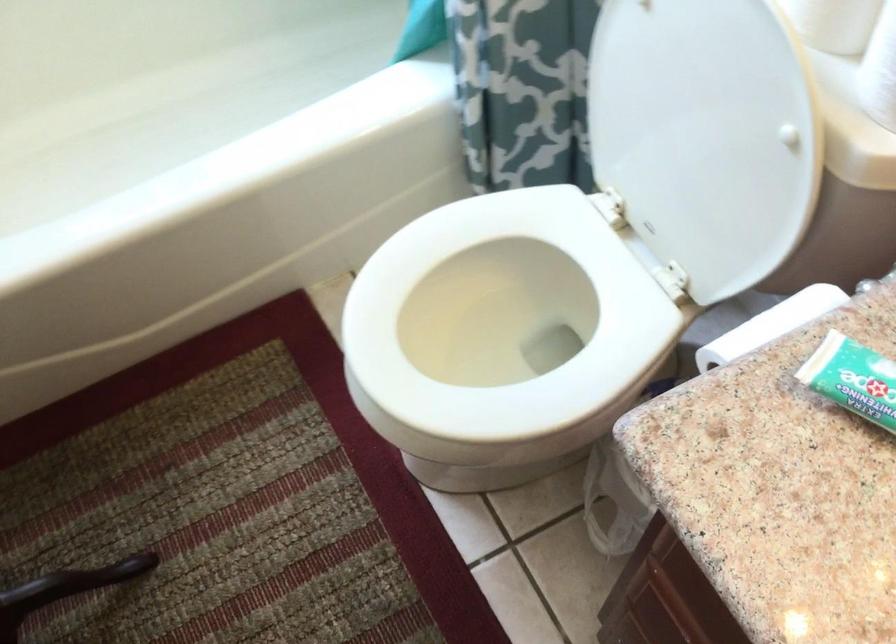
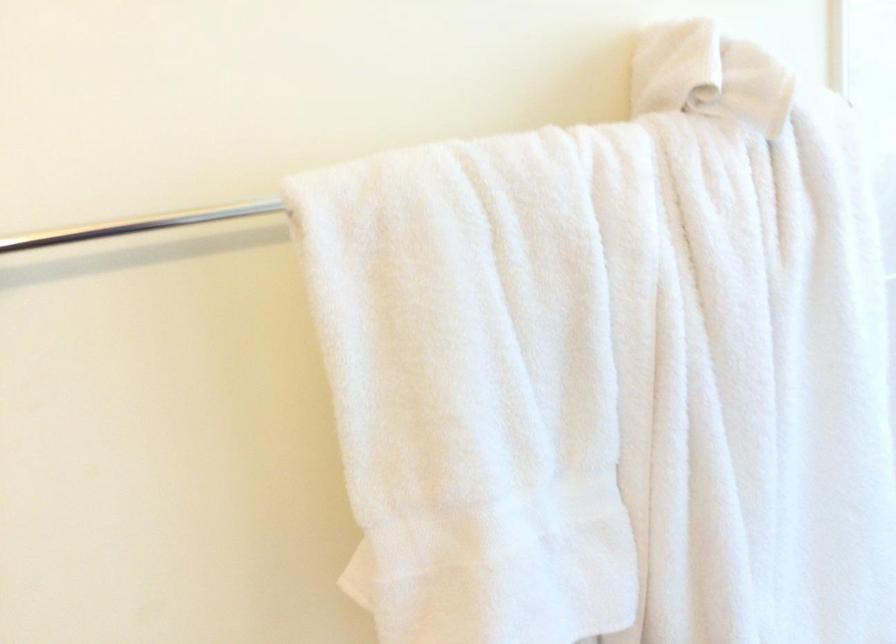
The first image is from the beginning of the video and the second image is from the end. How did the camera likely rotate when shooting the video?

The camera rotated toward left-down.